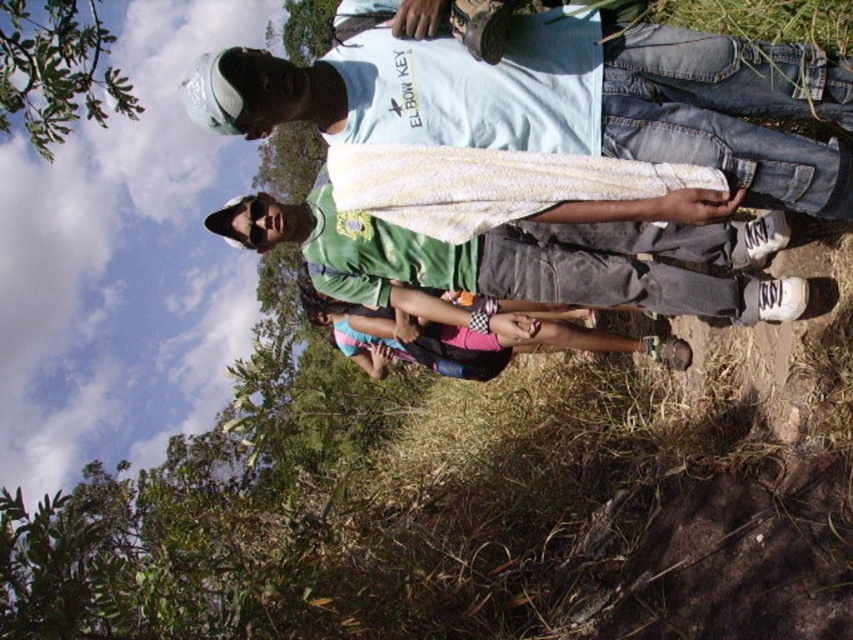
Between green fabric shirt at center and green grass at lower right, which one has more height?

→ green fabric shirt at center is taller.

Find the location of a particular element. The width and height of the screenshot is (853, 640). green fabric shirt at center is located at coordinates (529, 259).

Does point (368, 294) come farther from viewer compared to point (683, 26)?

Yes, point (368, 294) is behind point (683, 26).

Locate an element on the screen. The width and height of the screenshot is (853, 640). green fabric shirt at center is located at coordinates (529, 259).

Does green fabric shirt at center have a greater height compared to green leafy tree at upper left?

No.

Looking at this image, which is below, green fabric shirt at center or green leafy tree at upper left?

green fabric shirt at center is below.

Find the location of a particular element. The height and width of the screenshot is (640, 853). green fabric shirt at center is located at coordinates (529, 259).

Is white textured towel at center to the left of green leafy tree at upper left from the viewer's perspective?

No, white textured towel at center is not to the left of green leafy tree at upper left.

Between white textured towel at center and green leafy tree at upper left, which one is positioned higher?

Positioned higher is green leafy tree at upper left.

Is point (637, 104) positioned in front of point (56, 10)?

Yes.

Identify the location of white textured towel at center. The height and width of the screenshot is (640, 853). (560, 99).